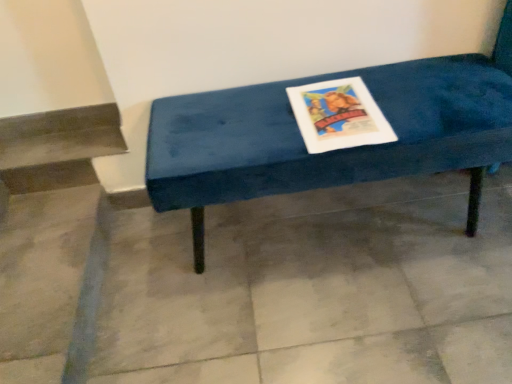
What are the coordinates of `vacant space in velvet blue bench at center (from a real-world perspective)` in the screenshot? It's located at (308, 225).